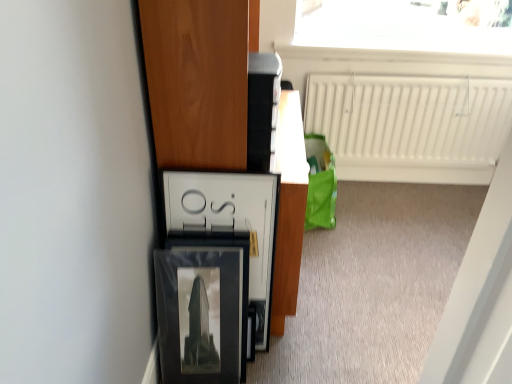
Question: Is wooden cabinet at left positioned behind matte black picture frame at lower left?

Choices:
 (A) no
 (B) yes

Answer: (A)

Question: Does wooden cabinet at left have a lesser height compared to matte black picture frame at lower left?

Choices:
 (A) yes
 (B) no

Answer: (B)

Question: Is wooden cabinet at left to the left of matte black picture frame at lower left from the viewer's perspective?

Choices:
 (A) yes
 (B) no

Answer: (B)

Question: Is wooden cabinet at left positioned with its back to matte black picture frame at lower left?

Choices:
 (A) no
 (B) yes

Answer: (A)

Question: Is wooden cabinet at left taller than matte black picture frame at lower left?

Choices:
 (A) no
 (B) yes

Answer: (B)

Question: From the image's perspective, is matte black picture frame at lower left positioned above or below white glossy frame at center?

Choices:
 (A) above
 (B) below

Answer: (B)

Question: Is matte black picture frame at lower left inside or outside of white glossy frame at center?

Choices:
 (A) inside
 (B) outside

Answer: (B)

Question: From a real-world perspective, is matte black picture frame at lower left above or below white glossy frame at center?

Choices:
 (A) above
 (B) below

Answer: (B)

Question: Considering the positions of matte black picture frame at lower left and white glossy frame at center in the image, is matte black picture frame at lower left wider or thinner than white glossy frame at center?

Choices:
 (A) thin
 (B) wide

Answer: (B)

Question: In terms of size, does wooden cabinet at left appear bigger or smaller than white glossy frame at center?

Choices:
 (A) big
 (B) small

Answer: (A)

Question: Would you say wooden cabinet at left is inside or outside white glossy frame at center?

Choices:
 (A) inside
 (B) outside

Answer: (B)

Question: From the image's perspective, is wooden cabinet at left positioned above or below white glossy frame at center?

Choices:
 (A) above
 (B) below

Answer: (A)

Question: From their relative heights in the image, would you say wooden cabinet at left is taller or shorter than white glossy frame at center?

Choices:
 (A) short
 (B) tall

Answer: (B)

Question: Considering the positions of matte black picture frame at lower left and white matte radiator at upper right in the image, is matte black picture frame at lower left wider or thinner than white matte radiator at upper right?

Choices:
 (A) wide
 (B) thin

Answer: (A)

Question: Based on their positions, is matte black picture frame at lower left located to the left or right of white matte radiator at upper right?

Choices:
 (A) left
 (B) right

Answer: (A)